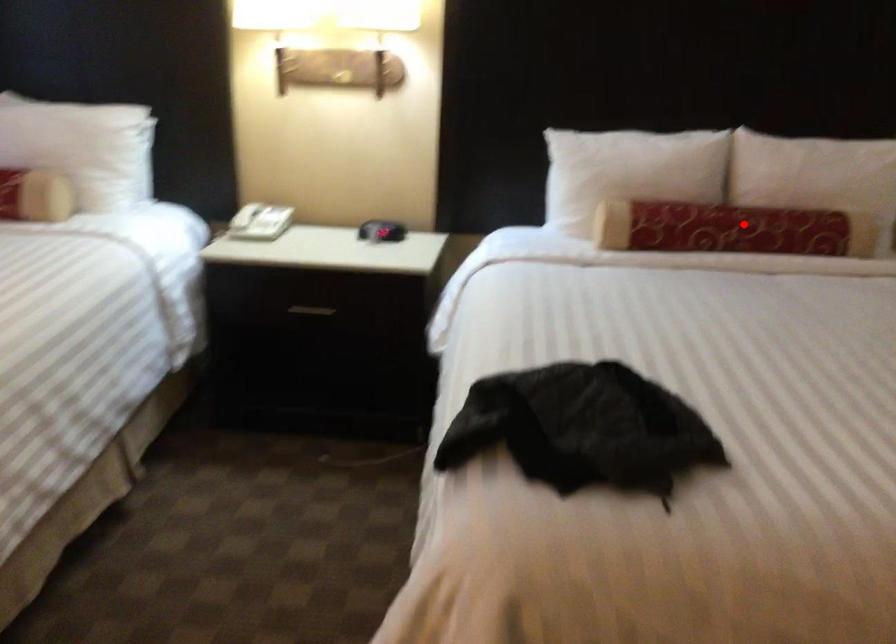
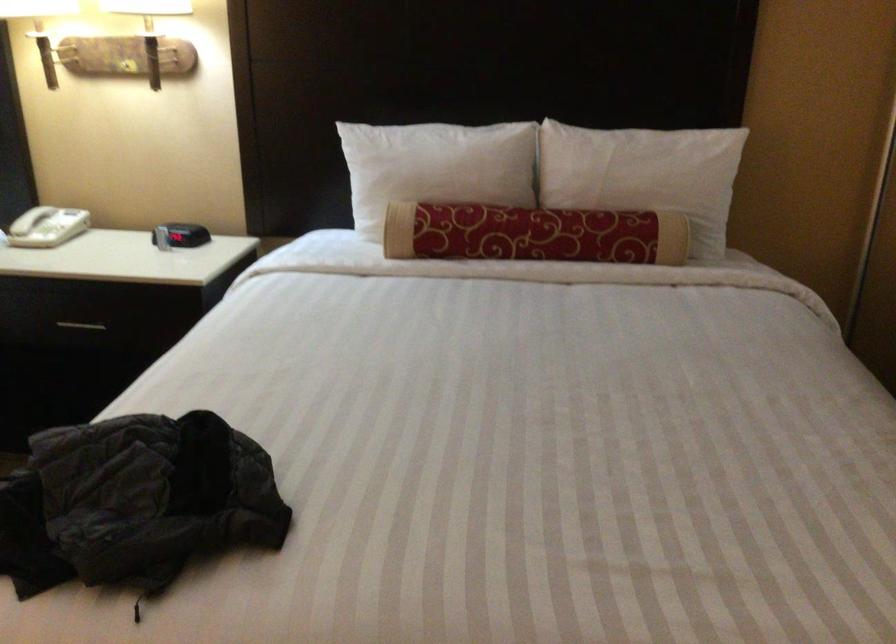
Question: I am providing you with two images of the same scene from different viewpoints. A red point is marked on the first image. Can you still see the location of the red point in image 2?

Choices:
 (A) Yes
 (B) No

Answer: (A)